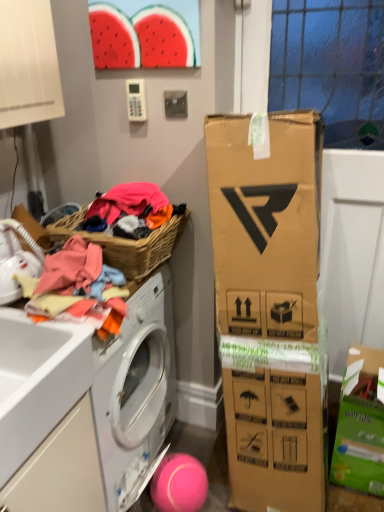
Question: From a real-world perspective, does pink rubber ball at lower center sit lower than white matte drawer at lower left?

Choices:
 (A) no
 (B) yes

Answer: (B)

Question: Is pink rubber ball at lower center bigger than white matte drawer at lower left?

Choices:
 (A) no
 (B) yes

Answer: (A)

Question: Does pink rubber ball at lower center contain white matte drawer at lower left?

Choices:
 (A) no
 (B) yes

Answer: (A)

Question: From the image's perspective, is pink rubber ball at lower center located above white matte drawer at lower left?

Choices:
 (A) no
 (B) yes

Answer: (A)

Question: Is pink rubber ball at lower center turned away from white matte drawer at lower left?

Choices:
 (A) no
 (B) yes

Answer: (A)

Question: Is pink rubber ball at lower center aimed at white matte drawer at lower left?

Choices:
 (A) no
 (B) yes

Answer: (A)

Question: Is pink rubber ball at lower center next to woven brown picnic basket at left?

Choices:
 (A) yes
 (B) no

Answer: (B)

Question: From a real-world perspective, is pink rubber ball at lower center beneath woven brown picnic basket at left?

Choices:
 (A) yes
 (B) no

Answer: (A)

Question: From a real-world perspective, does pink rubber ball at lower center stand above woven brown picnic basket at left?

Choices:
 (A) no
 (B) yes

Answer: (A)

Question: Does pink rubber ball at lower center have a larger size compared to woven brown picnic basket at left?

Choices:
 (A) no
 (B) yes

Answer: (A)

Question: Is pink rubber ball at lower center aimed at woven brown picnic basket at left?

Choices:
 (A) no
 (B) yes

Answer: (A)

Question: Considering the relative sizes of pink rubber ball at lower center and woven brown picnic basket at left in the image provided, is pink rubber ball at lower center thinner than woven brown picnic basket at left?

Choices:
 (A) yes
 (B) no

Answer: (A)

Question: Are woven brown picnic basket at left and pink rubber ball at lower center beside each other?

Choices:
 (A) yes
 (B) no

Answer: (B)